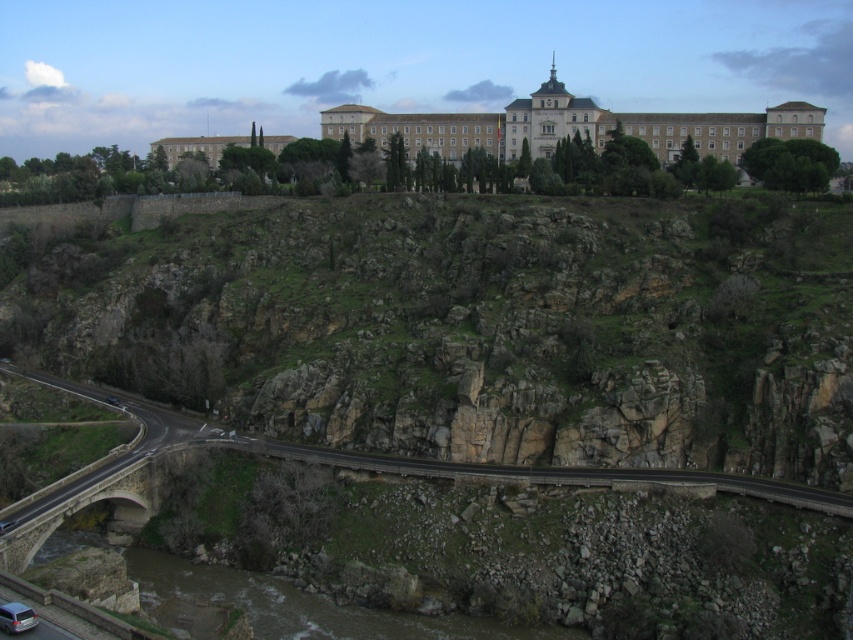
You are a hiker planning to reach the historic building on the hill. You see the brown stone river at lower left and the black asphalt road at lower center. Which path should you take to get closer to the building?

The black asphalt road at lower center is the correct path to take because it leads towards the building, while the brown stone river at lower left is positioned under it, indicating it might be further away or not directly accessible.

You are planning to drive a delivery truck that is 2 meters wide. You see the brown stone river at lower left and the black asphalt road at lower center in the image. Can your truck safely pass through the narrower pathway between them?

The brown stone river at lower left has a lesser width compared to black asphalt road at lower center. Since the river is narrower than the road, the truck cannot safely pass through the narrower pathway between them because the river is only 2 meters wide, which matches the truck width. However, the road is wider, so the truck should use the road instead.